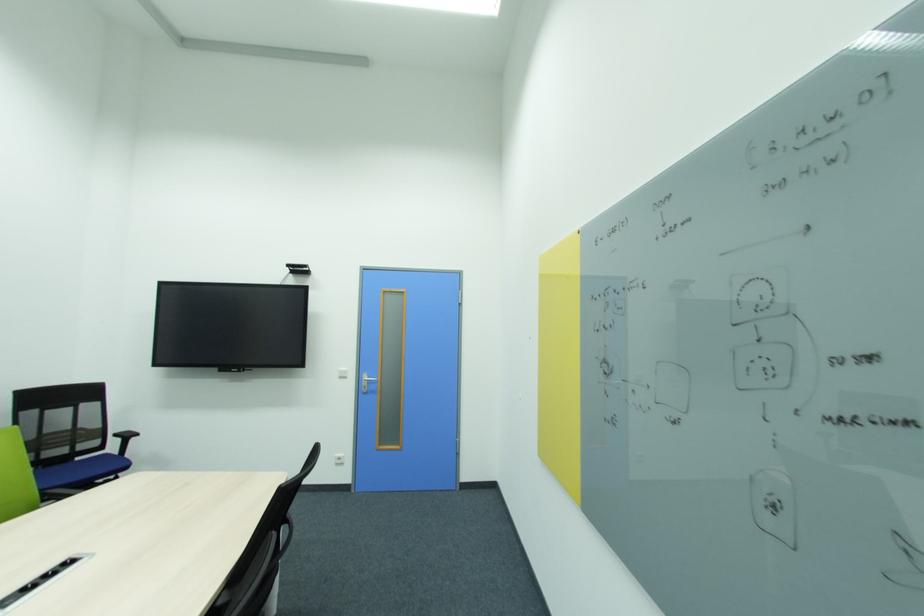
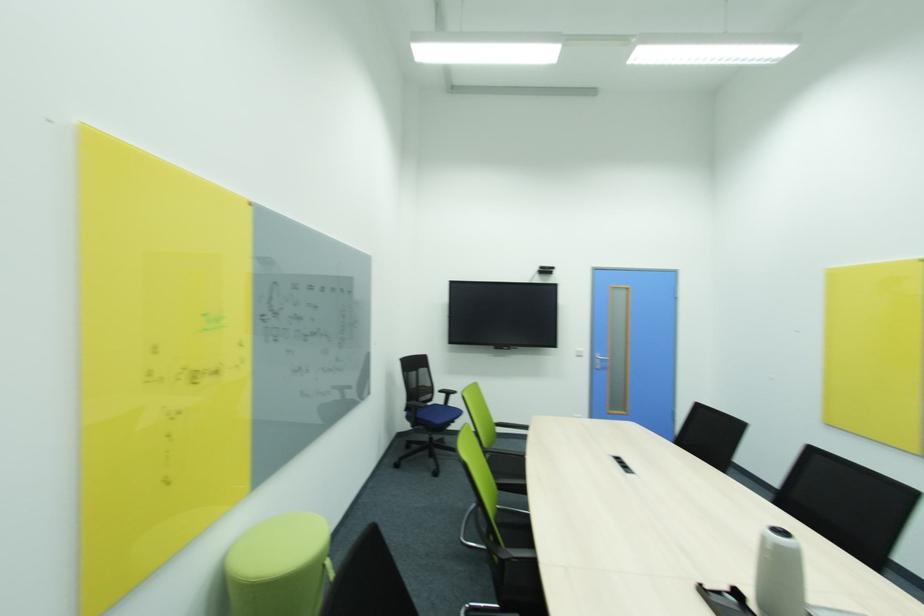
The point at (93, 408) is marked in the first image. Where is the corresponding point in the second image?

(428, 371)